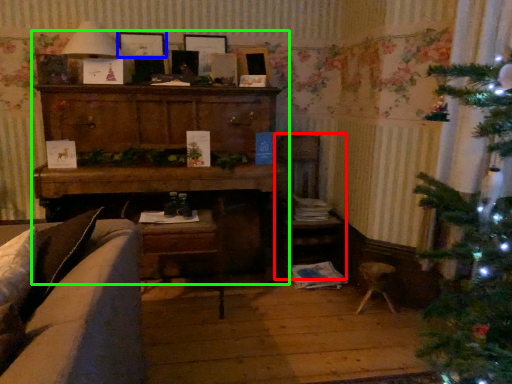
Question: Considering the real-world distances, which object is farthest from armchair (highlighted by a red box)? picture frame (highlighted by a blue box) or entertainment center (highlighted by a green box)?

Choices:
 (A) picture frame
 (B) entertainment center

Answer: (A)